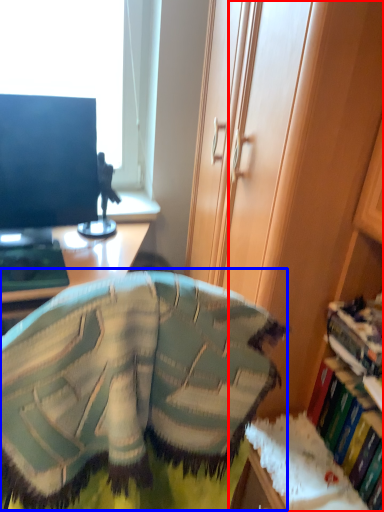
Question: Which object is further to the camera taking this photo, cabinetry (highlighted by a red box) or bean bag chair (highlighted by a blue box)?

Choices:
 (A) cabinetry
 (B) bean bag chair

Answer: (B)